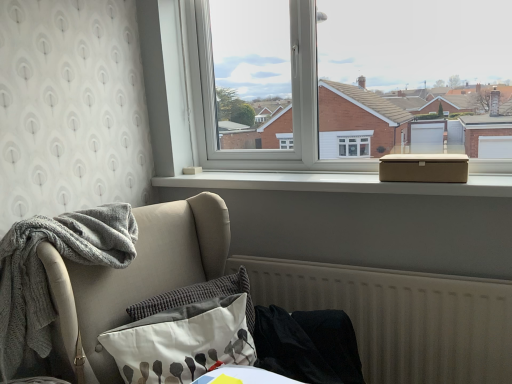
Question: Is textured gray pillow at lower left, marked as the first pillow in a front-to-back arrangement, in front of black fabric at lower right, the 2th material positioned from the left?

Choices:
 (A) yes
 (B) no

Answer: (A)

Question: Is textured gray pillow at lower left, marked as the first pillow in a front-to-back arrangement, shorter than black fabric at lower right, arranged as the first material when viewed from the right?

Choices:
 (A) no
 (B) yes

Answer: (B)

Question: From the image's perspective, is textured gray pillow at lower left, marked as the first pillow in a front-to-back arrangement, beneath black fabric at lower right, arranged as the first material when viewed from the right?

Choices:
 (A) no
 (B) yes

Answer: (A)

Question: Is the surface of textured gray pillow at lower left, marked as the first pillow in a front-to-back arrangement, in direct contact with black fabric at lower right, the 2th material positioned from the left?

Choices:
 (A) yes
 (B) no

Answer: (B)

Question: From the image's perspective, would you say textured gray pillow at lower left, which is the 2th pillow from back to front, is positioned over black fabric at lower right, arranged as the first material when viewed from the right?

Choices:
 (A) no
 (B) yes

Answer: (B)

Question: Is textured gray pillow at lower center, marked as the second pillow in a front-to-back arrangement, inside or outside of gray knitted blanket at left, which is the 2th material from right to left?

Choices:
 (A) inside
 (B) outside

Answer: (B)

Question: Is textured gray pillow at lower center, acting as the first pillow starting from the back, taller or shorter than gray knitted blanket at left, arranged as the 1th material when viewed from the left?

Choices:
 (A) tall
 (B) short

Answer: (B)

Question: From a real-world perspective, is textured gray pillow at lower center, marked as the second pillow in a front-to-back arrangement, positioned above or below gray knitted blanket at left, arranged as the 1th material when viewed from the left?

Choices:
 (A) below
 (B) above

Answer: (A)

Question: Considering the positions of textured gray pillow at lower center, acting as the first pillow starting from the back, and gray knitted blanket at left, arranged as the 1th material when viewed from the left, in the image, is textured gray pillow at lower center, acting as the first pillow starting from the back, bigger or smaller than gray knitted blanket at left, arranged as the 1th material when viewed from the left,?

Choices:
 (A) big
 (B) small

Answer: (B)

Question: Looking at the image, does textured gray pillow at lower center, marked as the second pillow in a front-to-back arrangement, seem bigger or smaller compared to brown cardboard box at upper right?

Choices:
 (A) big
 (B) small

Answer: (A)

Question: From the image's perspective, is textured gray pillow at lower center, marked as the second pillow in a front-to-back arrangement, positioned above or below brown cardboard box at upper right?

Choices:
 (A) above
 (B) below

Answer: (B)

Question: From their relative heights in the image, would you say textured gray pillow at lower center, marked as the second pillow in a front-to-back arrangement, is taller or shorter than brown cardboard box at upper right?

Choices:
 (A) short
 (B) tall

Answer: (B)

Question: Is textured gray pillow at lower center, acting as the first pillow starting from the back, in front of or behind brown cardboard box at upper right in the image?

Choices:
 (A) behind
 (B) front

Answer: (B)

Question: Visually, is gray knitted blanket at left, which is the 2th material from right to left, positioned to the left or to the right of black fabric at lower right, arranged as the first material when viewed from the right?

Choices:
 (A) left
 (B) right

Answer: (A)

Question: From their relative heights in the image, would you say gray knitted blanket at left, which is the 2th material from right to left, is taller or shorter than black fabric at lower right, arranged as the first material when viewed from the right?

Choices:
 (A) tall
 (B) short

Answer: (A)